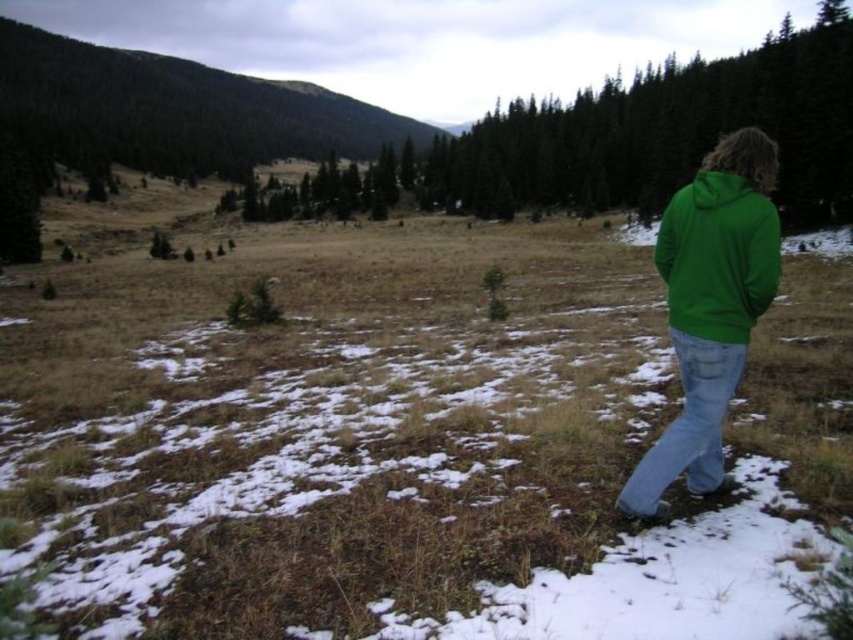
You are a photographer trying to capture both the green fabric jacket at right and the green fleece jacket at right in the same frame. Which jacket will appear larger in the photo?

The green fabric jacket at right will appear larger in the photo because it is bigger than the green fleece jacket at right.

In the scene shown: You are a photographer trying to capture the person in the scene. You notice two green items on the right side of the image. Which one is taller between the green fabric jacket at right and the green fleece sweatshirt at right?

The green fabric jacket at right is taller than the green fleece sweatshirt at right.